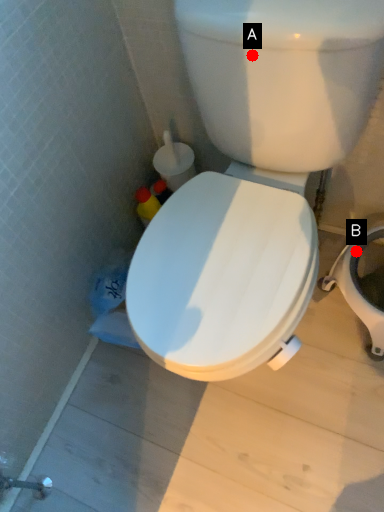
Question: Two points are circled on the image, labeled by A and B beside each circle. Which point is closer to the camera?

Choices:
 (A) A is closer
 (B) B is closer

Answer: (A)